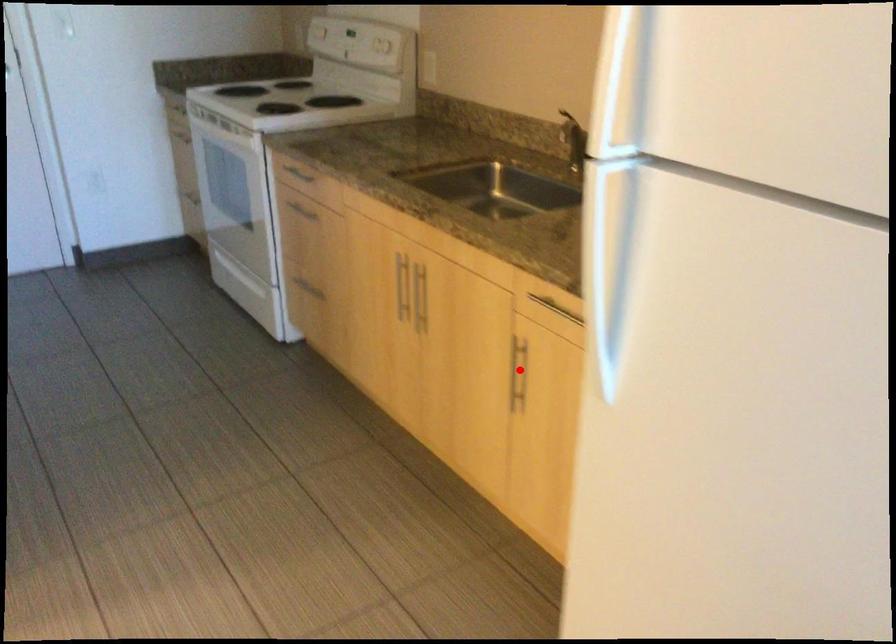
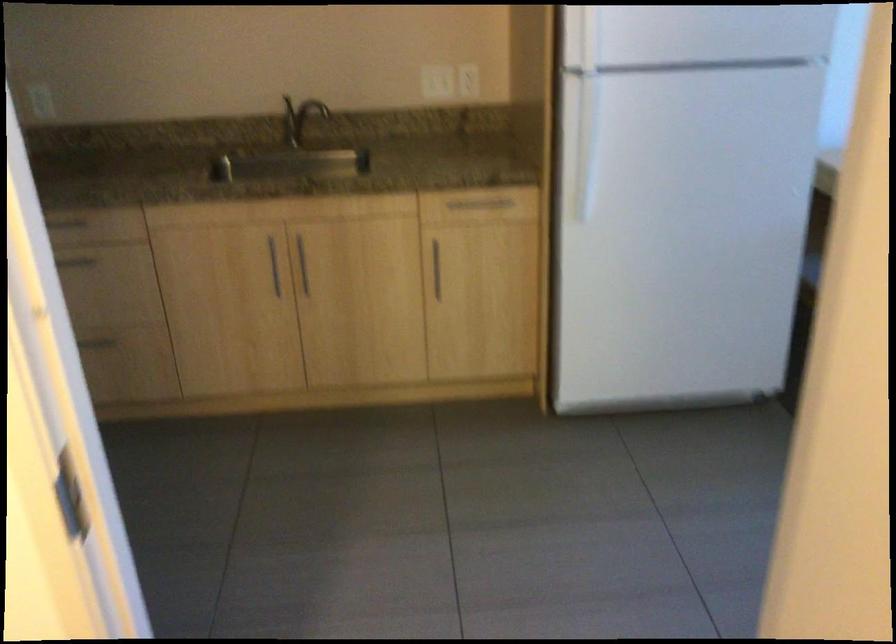
Where in the second image is the point corresponding to the highlighted location from the first image?

(435, 269)